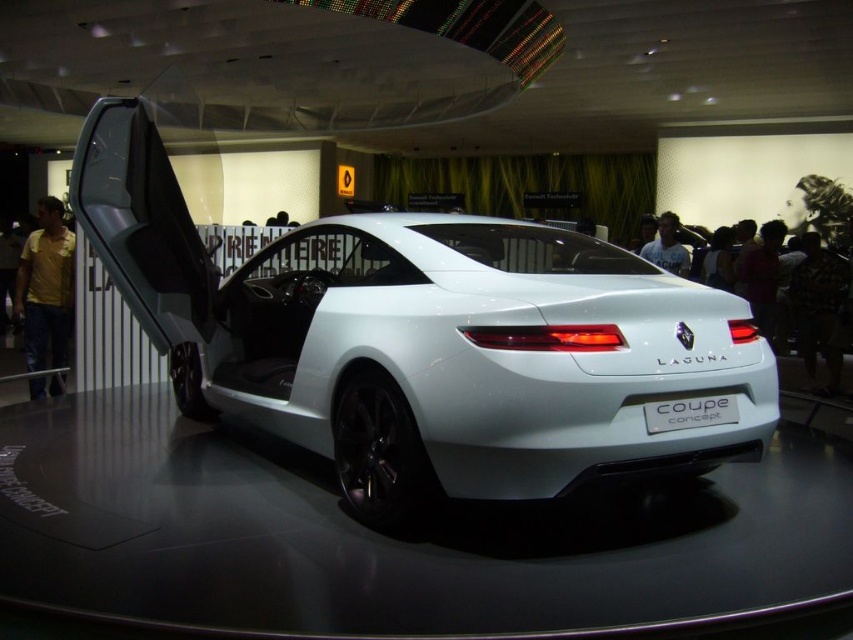
Consider the image. Can you confirm if white matte coupe at center is positioned to the right of dark hair at upper right?

In fact, white matte coupe at center is to the left of dark hair at upper right.

This screenshot has width=853, height=640. I want to click on white matte coupe at center, so click(428, 340).

Where is `white matte coupe at center`? white matte coupe at center is located at coordinates (428, 340).

From the picture: Is white matte coupe at center further to the viewer compared to yellow cotton shirt at left?

No, it is not.

Locate an element on the screen. white matte coupe at center is located at coordinates (428, 340).

Can you confirm if yellow cotton shirt at left is wider than dark hair at upper right?

Yes.

Can you confirm if yellow cotton shirt at left is taller than dark hair at upper right?

Indeed, yellow cotton shirt at left has a greater height compared to dark hair at upper right.

Locate an element on the screen. Image resolution: width=853 pixels, height=640 pixels. yellow cotton shirt at left is located at coordinates (45, 285).

Locate an element on the screen. yellow cotton shirt at left is located at coordinates (45, 285).